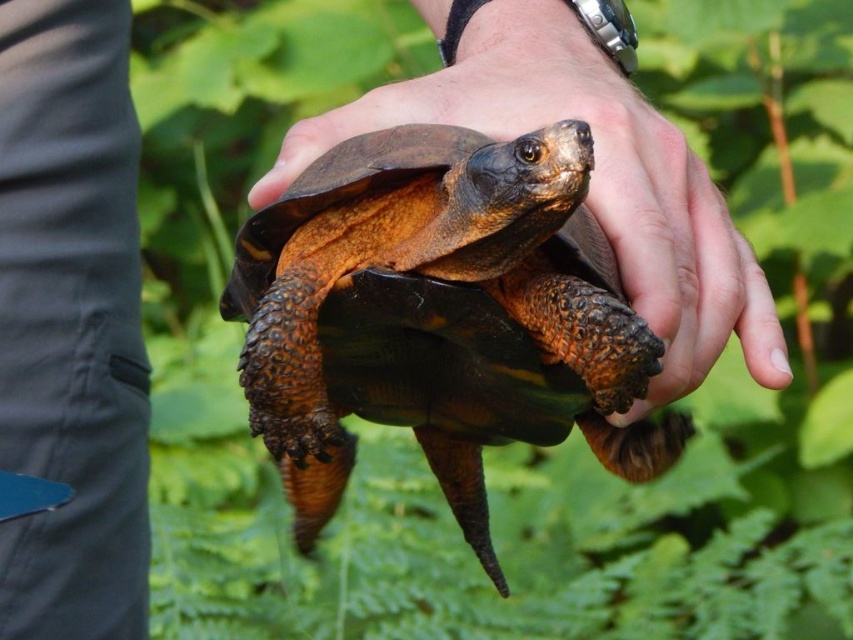
Question: Is the position of brown rough textured tortoise at center less distant than that of brown rough skin at center?

Choices:
 (A) no
 (B) yes

Answer: (B)

Question: From the image, what is the correct spatial relationship of brown rough textured tortoise at center in relation to brown rough skin at center?

Choices:
 (A) left
 (B) right

Answer: (A)

Question: Which of the following is the closest to the observer?

Choices:
 (A) brown rough skin at center
 (B) brown rough textured tortoise at center

Answer: (B)

Question: Does brown rough textured tortoise at center have a greater width compared to brown rough skin at center?

Choices:
 (A) yes
 (B) no

Answer: (B)

Question: Which point is farther to the camera?

Choices:
 (A) (403, 220)
 (B) (676, 182)

Answer: (B)